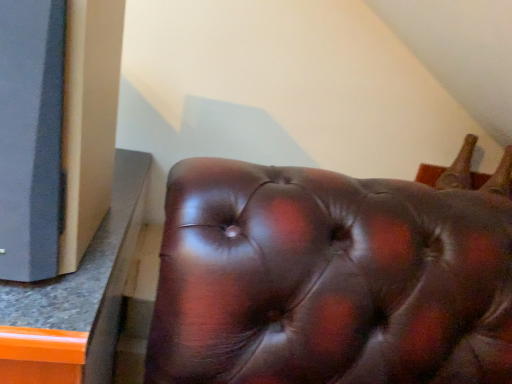
In order to click on brown leather ottoman at lower right in this screenshot , I will do `click(77, 297)`.

What do you see at coordinates (77, 297) in the screenshot?
I see `brown leather ottoman at lower right` at bounding box center [77, 297].

At what (x,y) coordinates should I click in order to perform the action: click on brown leather ottoman at lower right. Please return your answer as a coordinate pair (x, y). The image size is (512, 384). Looking at the image, I should click on (77, 297).